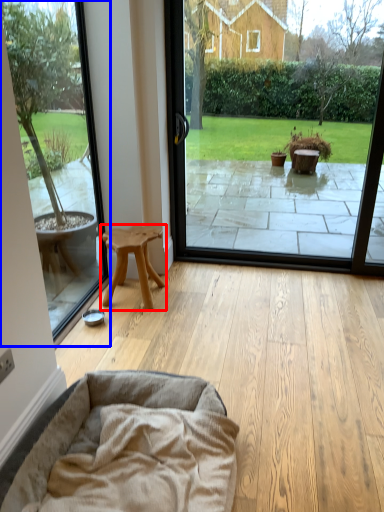
Question: Among these objects, which one is nearest to the camera, stool (highlighted by a red box) or window screen (highlighted by a blue box)?

Choices:
 (A) stool
 (B) window screen

Answer: (B)